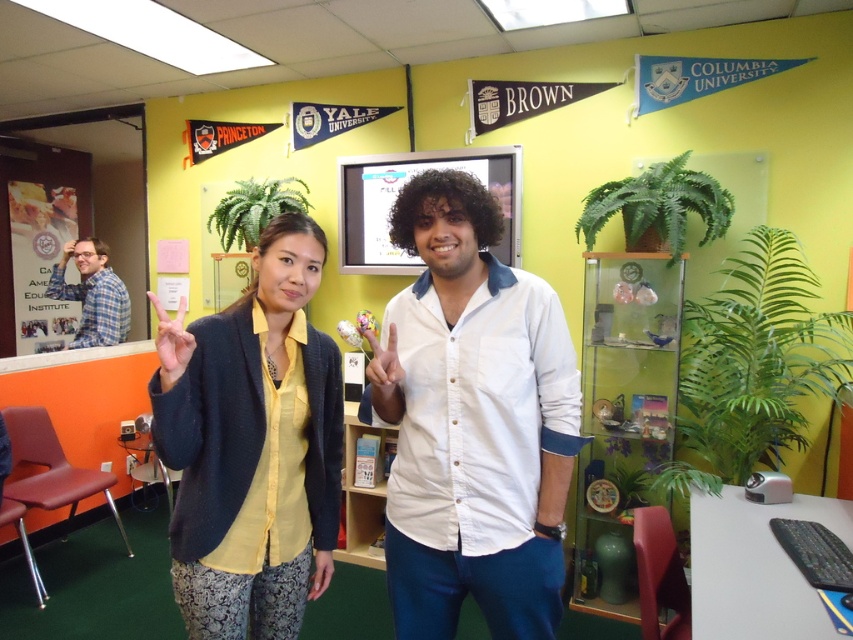
Question: Which is farther from the white cotton shirt at center?

Choices:
 (A) green leafy plant at right
 (B) plaid fabric shirt at left
 (C) green leafy plant at upper right

Answer: (B)

Question: Can you confirm if matte yellow shirt at center is bigger than green leafy plant at upper center?

Choices:
 (A) yes
 (B) no

Answer: (A)

Question: Among these objects, which one is farthest from the camera?

Choices:
 (A) green leafy plant at right
 (B) white cotton shirt at center
 (C) plaid fabric shirt at left
 (D) matte yellow shirt at center

Answer: (C)

Question: Can you confirm if white cotton shirt at center is positioned above plaid fabric shirt at left?

Choices:
 (A) yes
 (B) no

Answer: (B)

Question: Is plaid fabric shirt at left behind green leafy plant at upper center?

Choices:
 (A) yes
 (B) no

Answer: (A)

Question: Which object is positioned closest to the green leafy plant at upper center?

Choices:
 (A) matte yellow shirt at center
 (B) green leafy plant at upper right
 (C) green leafy plant at right

Answer: (B)